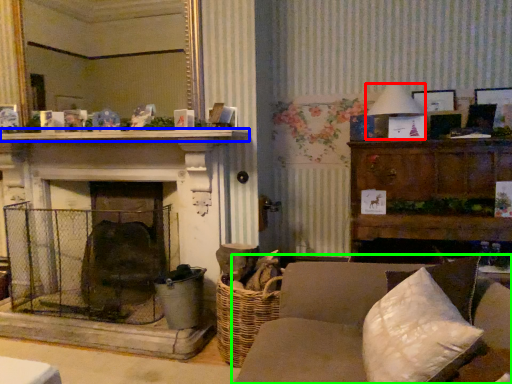
Question: Based on their relative distances, which object is nearer to lamp (highlighted by a red box)? Choose from mantle (highlighted by a blue box) and studio couch (highlighted by a green box).

Choices:
 (A) mantle
 (B) studio couch

Answer: (A)